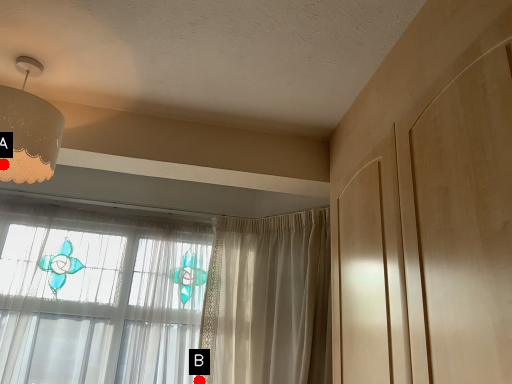
Question: Two points are circled on the image, labeled by A and B beside each circle. Which point is closer to the camera?

Choices:
 (A) A is closer
 (B) B is closer

Answer: (A)